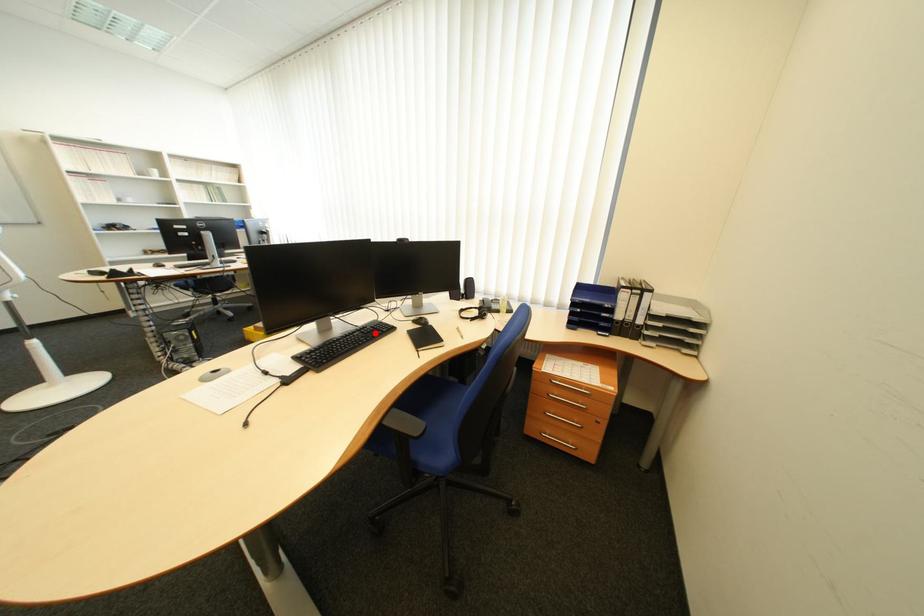
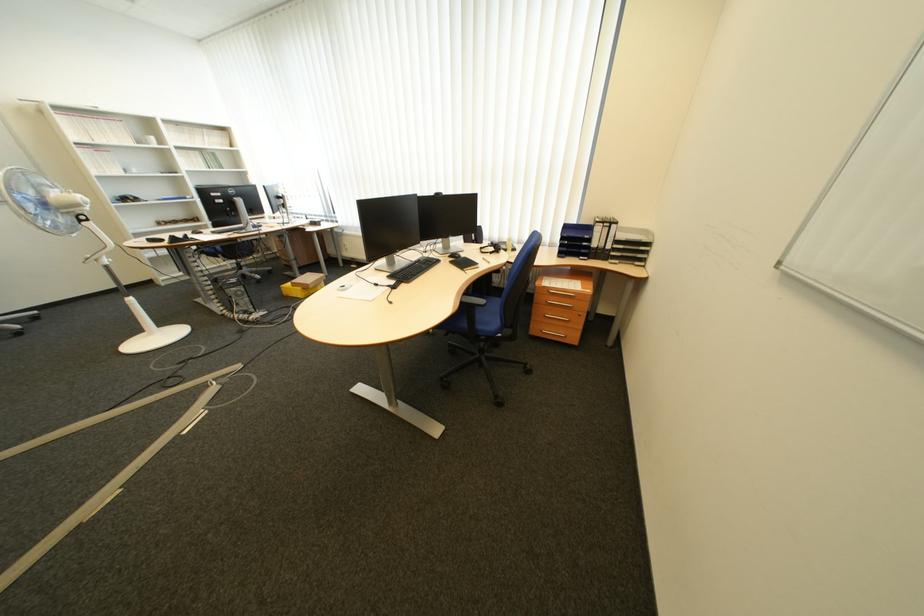
Find the pixel in the second image that matches the highlighted location in the first image.

(433, 264)